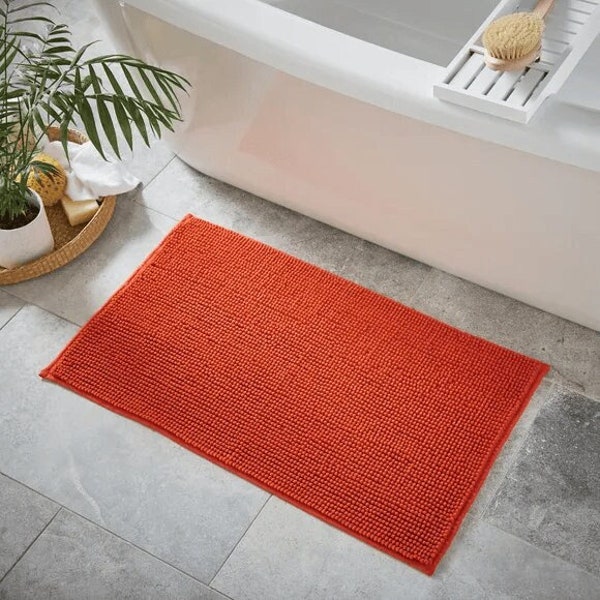
Find the location of a particular element. The image size is (600, 600). bath tub is located at coordinates (336, 62).